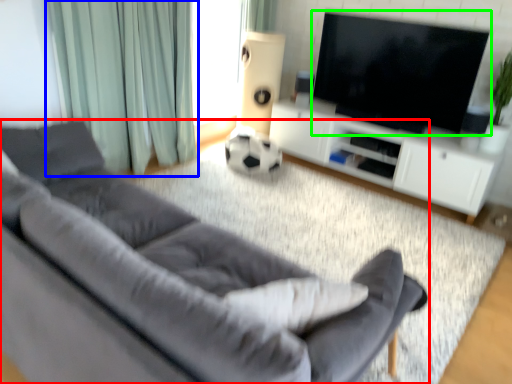
Question: Which is farther away from studio couch (highlighted by a red box)? curtain (highlighted by a blue box) or television (highlighted by a green box)?

Choices:
 (A) curtain
 (B) television

Answer: (B)